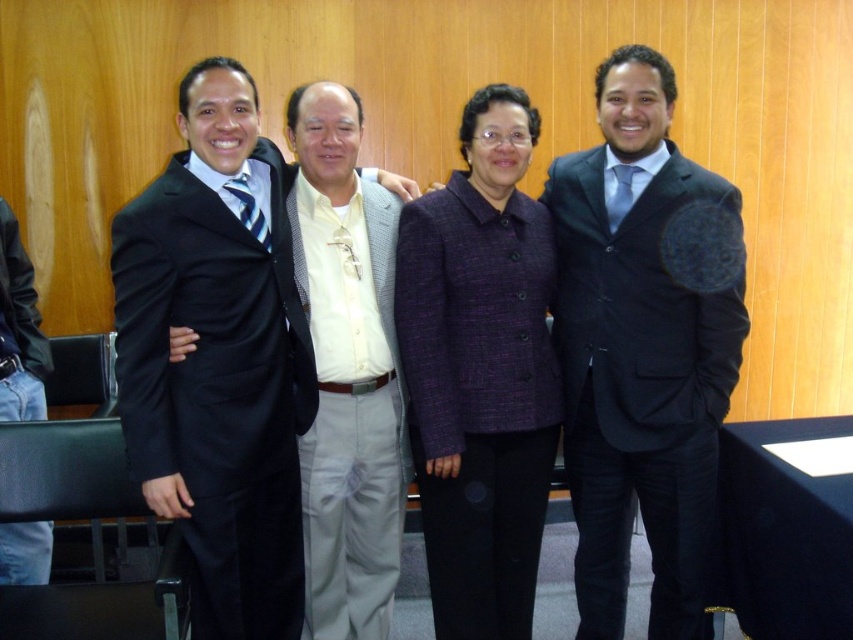
Question: Which of these objects is positioned farthest from the white textured shirt at center?

Choices:
 (A) matte black suit at right
 (B) matte black suit at left

Answer: (A)

Question: From the image, what is the correct spatial relationship of matte black suit at left in relation to matte black suit at right?

Choices:
 (A) right
 (B) left

Answer: (B)

Question: Is matte black suit at left behind purple textured blazer at center?

Choices:
 (A) no
 (B) yes

Answer: (A)

Question: Which of the following is the closest to the observer?

Choices:
 (A) (514, 525)
 (B) (196, 314)
 (C) (718, 369)
 (D) (326, 323)

Answer: (B)

Question: Is matte black suit at left positioned before white textured shirt at center?

Choices:
 (A) no
 (B) yes

Answer: (B)

Question: Which object appears farthest from the camera in this image?

Choices:
 (A) purple textured blazer at center
 (B) matte black suit at right

Answer: (B)